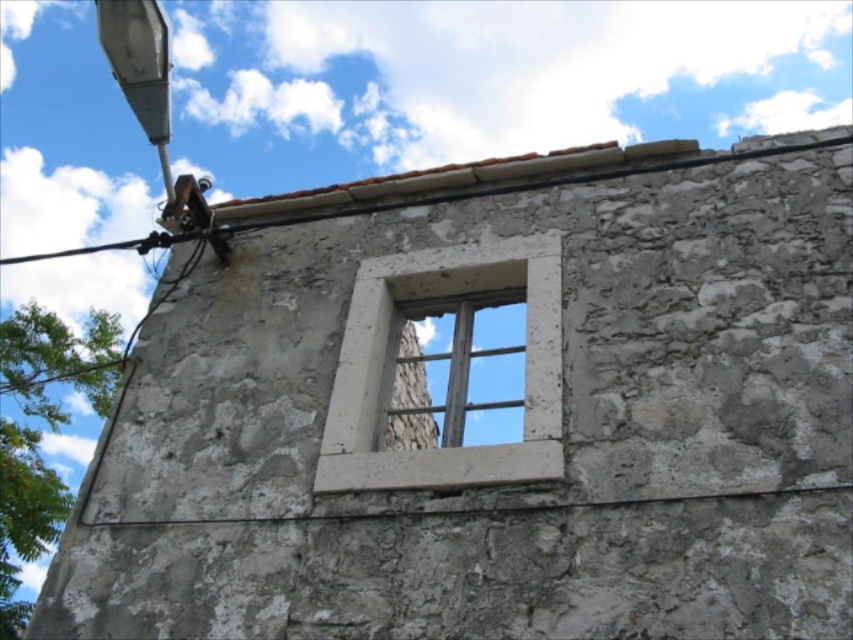
Can you confirm if white stone window frame at center is bigger than wooden window at center?

No, white stone window frame at center is not bigger than wooden window at center.

Is point (531, 278) more distant than point (450, 371)?

No, (531, 278) is in front of (450, 371).

You are a GUI agent. You are given a task and a screenshot of the screen. Output one action in this format:
    pyautogui.click(x=<x>, y=<y>)
    Task: Click on the white stone window frame at center
    The width and height of the screenshot is (853, 640).
    Given the screenshot: What is the action you would take?
    pyautogui.click(x=383, y=360)